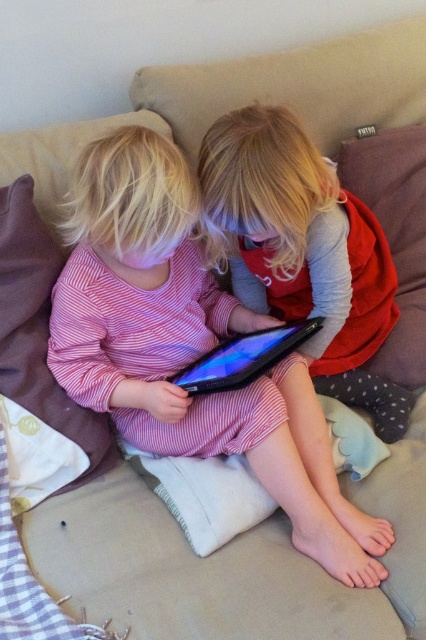
You are a photographer taking a picture of the children on the couch. The pink striped dress at center and the black matte tablet at center are both in the frame. Which object is closer to the camera?

The pink striped dress at center is in front of the black matte tablet at center, so it is closer to the camera.

You are a parent trying to locate your child who is sitting on a beige couch holding a matte black tablet at center. Where would you look on the couch?

The matte black tablet at center is located at point (304, 252), so you should look at the center of the couch where the tablet is placed.

You are a photographer trying to capture a closeup of the tablet screen. You see two tablets, the matte black tablet at center and the black matte tablet at center. Which tablet is positioned closer to you?

The matte black tablet at center is closer to the viewer than the black matte tablet at center.